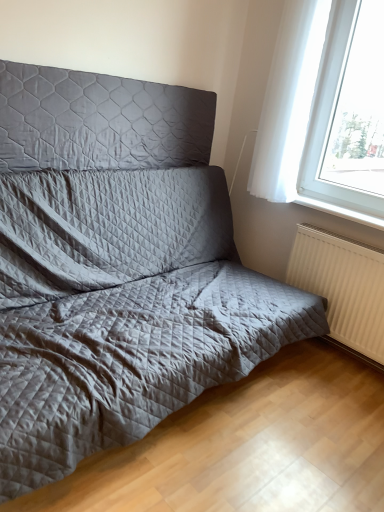
Locate an element on the screen. white sheer curtain at upper right is located at coordinates (307, 112).

Locate an element on the screen. This screenshot has height=512, width=384. white glossy window sill at lower right is located at coordinates (340, 211).

Image resolution: width=384 pixels, height=512 pixels. What do you see at coordinates (340, 211) in the screenshot?
I see `white glossy window sill at lower right` at bounding box center [340, 211].

Where is `quilted fabric headboard at upper left`? quilted fabric headboard at upper left is located at coordinates pyautogui.click(x=99, y=121).

What are the coordinates of `white sheer curtain at upper right` in the screenshot? It's located at (307, 112).

Is white glossy window sill at lower right not inside white sheer curtain at upper right?

Yes, white glossy window sill at lower right is outside of white sheer curtain at upper right.

Is white glossy window sill at lower right in contact with white sheer curtain at upper right?

white glossy window sill at lower right is not next to white sheer curtain at upper right, and they're not touching.

Considering the sizes of white glossy window sill at lower right and white sheer curtain at upper right in the image, is white glossy window sill at lower right taller or shorter than white sheer curtain at upper right?

Clearly, white glossy window sill at lower right is shorter compared to white sheer curtain at upper right.

From a real-world perspective, is white sheer curtain at upper right physically below quilted fabric headboard at upper left?

No.

Between white sheer curtain at upper right and quilted fabric headboard at upper left, which one has larger width?

Wider between the two is white sheer curtain at upper right.

Based on the photo, is white sheer curtain at upper right aimed at quilted fabric headboard at upper left?

No, white sheer curtain at upper right is not oriented towards quilted fabric headboard at upper left.

From the image's perspective, between white sheer curtain at upper right and quilted fabric headboard at upper left, which one is located above?

white sheer curtain at upper right is shown above in the image.

From the image's perspective, is white glossy window sill at lower right located above quilted fabric headboard at upper left?

No, from the image's perspective, white glossy window sill at lower right is not on top of quilted fabric headboard at upper left.

Is white glossy window sill at lower right looking in the opposite direction of quilted fabric headboard at upper left?

No, white glossy window sill at lower right's orientation is not away from quilted fabric headboard at upper left.

What's the angular difference between white glossy window sill at lower right and quilted fabric headboard at upper left's facing directions?

white glossy window sill at lower right and quilted fabric headboard at upper left are facing 89.5 degrees away from each other.

From a real-world perspective, relative to quilted fabric headboard at upper left, is white glossy window sill at lower right vertically above or below?

Clearly, from a real-world perspective, white glossy window sill at lower right is below quilted fabric headboard at upper left.

Does white glossy window sill at lower right have a lesser height compared to white textured radiator at lower right?

Yes, white glossy window sill at lower right is shorter than white textured radiator at lower right.

Is there a large distance between white glossy window sill at lower right and white textured radiator at lower right?

Actually, white glossy window sill at lower right and white textured radiator at lower right are a little close together.

Locate an element on the screen. window sill on the right of white textured radiator at lower right is located at coordinates (340, 211).

Choose the correct answer: Is white glossy window sill at lower right inside white textured radiator at lower right or outside it?

white glossy window sill at lower right exists outside the volume of white textured radiator at lower right.

Is the surface of white textured radiator at lower right in direct contact with white sheer curtain at upper right?

white textured radiator at lower right is not next to white sheer curtain at upper right, and they're not touching.

Between white textured radiator at lower right and white sheer curtain at upper right, which one has larger width?

Wider between the two is white sheer curtain at upper right.

Is white textured radiator at lower right shorter than white sheer curtain at upper right?

Yes, white textured radiator at lower right is shorter than white sheer curtain at upper right.

Between white sheer curtain at upper right and white textured radiator at lower right, which one has larger width?

white sheer curtain at upper right is wider.

From a real-world perspective, is white sheer curtain at upper right positioned above or below white textured radiator at lower right?

In terms of real-world spatial position, white sheer curtain at upper right is above white textured radiator at lower right.

Which object is further away from the camera taking this photo, white sheer curtain at upper right or white textured radiator at lower right?

white textured radiator at lower right.

Measure the distance from white sheer curtain at upper right to white textured radiator at lower right.

A distance of 27.50 inches exists between white sheer curtain at upper right and white textured radiator at lower right.

Are white textured radiator at lower right and white glossy window sill at lower right located far from each other?

white textured radiator at lower right is actually quite close to white glossy window sill at lower right.

How far apart are white textured radiator at lower right and white glossy window sill at lower right?

white textured radiator at lower right is 14.33 inches away from white glossy window sill at lower right.

Which is correct: white textured radiator at lower right is inside white glossy window sill at lower right, or outside of it?

white textured radiator at lower right lies outside white glossy window sill at lower right.

Which is closer to the camera, [367,333] or [359,216]?

Point [367,333] appears to be closer to the viewer than point [359,216].

Identify the location of window sill to the right of white sheer curtain at upper right. (340, 211).

Where is `headboard below the white sheer curtain at upper right (from a real-world perspective)`? This screenshot has width=384, height=512. headboard below the white sheer curtain at upper right (from a real-world perspective) is located at coordinates (99, 121).

Considering their positions, is white sheer curtain at upper right positioned further to white glossy window sill at lower right than white textured radiator at lower right?

Among the two, white sheer curtain at upper right is located further to white glossy window sill at lower right.

From the image, which object appears to be farther from quilted fabric headboard at upper left, white glossy window sill at lower right or white sheer curtain at upper right?

white glossy window sill at lower right lies further to quilted fabric headboard at upper left than the other object.

Considering their positions, is white textured radiator at lower right positioned further to white sheer curtain at upper right than quilted fabric headboard at upper left?

Based on the image, quilted fabric headboard at upper left appears to be further to white sheer curtain at upper right.

Looking at this image, when comparing their distances from white sheer curtain at upper right, does white textured radiator at lower right or white glossy window sill at lower right seem closer?

Based on the image, white glossy window sill at lower right appears to be nearer to white sheer curtain at upper right.

Estimate the real-world distances between objects in this image. Which object is closer to white textured radiator at lower right, white glossy window sill at lower right or white sheer curtain at upper right?

The object closer to white textured radiator at lower right is white glossy window sill at lower right.

Based on their spatial positions, is white textured radiator at lower right or white sheer curtain at upper right closer to white sheer curtain at upper right?

white sheer curtain at upper right is positioned closer to the anchor white sheer curtain at upper right.

Estimate the real-world distances between objects in this image. Which object is further from white sheer curtain at upper right, quilted fabric headboard at upper left or white sheer curtain at upper right?

quilted fabric headboard at upper left.

Based on their spatial positions, is white glossy window sill at lower right or white sheer curtain at upper right further from quilted fabric headboard at upper left?

white glossy window sill at lower right is further to quilted fabric headboard at upper left.

Identify the location of window screen between white sheer curtain at upper right and white textured radiator at lower right in the up-down direction. The height and width of the screenshot is (512, 384). (359, 108).

The image size is (384, 512). I want to click on window sill between white sheer curtain at upper right and white textured radiator at lower right in the up-down direction, so tap(340, 211).

Identify the location of window between quilted fabric headboard at upper left and white glossy window sill at lower right from left to right. This screenshot has height=512, width=384. [x=307, y=112].

Where is `window sill located between quilted fabric headboard at upper left and white sheer curtain at upper right in the left-right direction`? Image resolution: width=384 pixels, height=512 pixels. window sill located between quilted fabric headboard at upper left and white sheer curtain at upper right in the left-right direction is located at coordinates (340, 211).